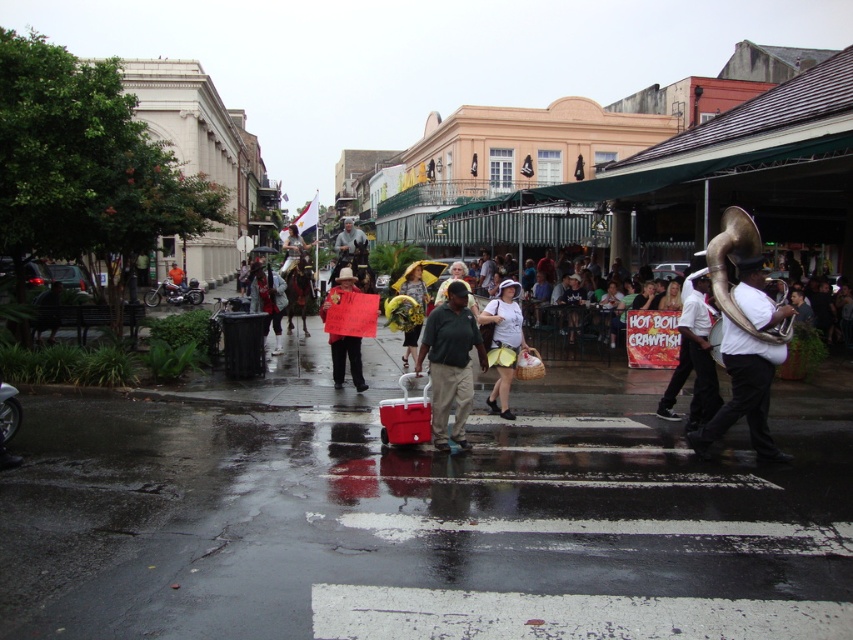
Is point (689, 602) in front of point (302, 307)?

That is True.

Does smooth asphalt pavement at center lie behind red fabric sign at center?

No, it is not.

Where is `smooth asphalt pavement at center`? The image size is (853, 640). smooth asphalt pavement at center is located at coordinates (412, 529).

Locate an element on the screen. smooth asphalt pavement at center is located at coordinates (412, 529).

Does point (9, 506) lie behind point (167, 275)?

No, (9, 506) is in front of (167, 275).

Is point (28, 454) more distant than point (181, 275)?

That is False.

This screenshot has height=640, width=853. Find the location of `smooth asphalt pavement at center`. smooth asphalt pavement at center is located at coordinates (412, 529).

Who is taller, green cotton shirt at center or matte black sign at center?

green cotton shirt at center is taller.

Identify the location of green cotton shirt at center. (450, 364).